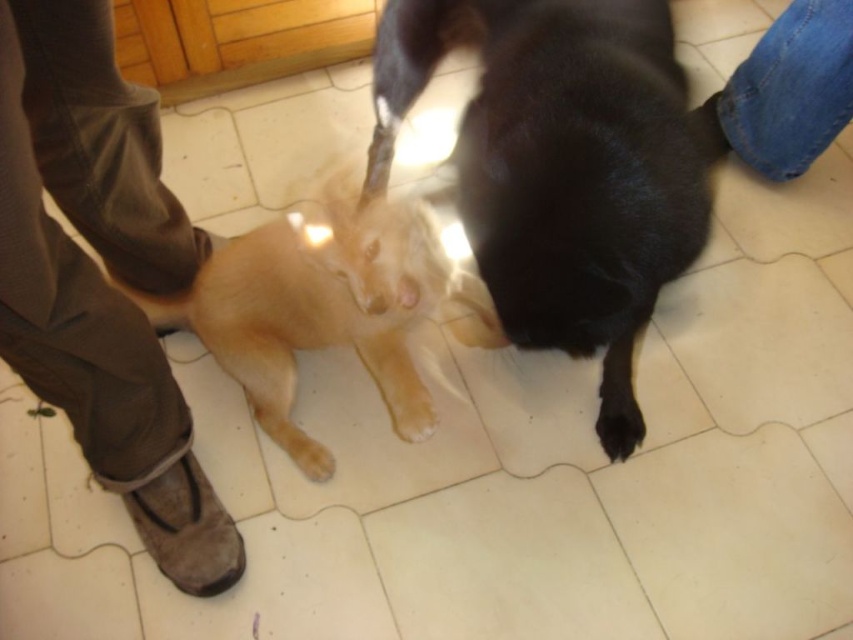
Is golden fur dog at center shorter than black fur paw at lower center?

Incorrect, golden fur dog at center's height does not fall short of black fur paw at lower center's.

Is golden fur dog at center smaller than black fur paw at lower center?

Incorrect, golden fur dog at center is not smaller in size than black fur paw at lower center.

At what (x,y) coordinates should I click in order to perform the action: click on golden fur dog at center. Please return your answer as a coordinate pair (x, y). Image resolution: width=853 pixels, height=640 pixels. Looking at the image, I should click on (328, 307).

Where is `golden fur dog at center`? The width and height of the screenshot is (853, 640). golden fur dog at center is located at coordinates (328, 307).

Measure the distance between jeans at right and black fur paw at lower center.

A distance of 28.34 inches exists between jeans at right and black fur paw at lower center.

From the picture: Does jeans at right have a smaller size compared to black fur paw at lower center?

Incorrect, jeans at right is not smaller in size than black fur paw at lower center.

Image resolution: width=853 pixels, height=640 pixels. What are the coordinates of `jeans at right` in the screenshot? It's located at (790, 90).

From the picture: Does golden fur dog at center have a lesser height compared to jeans at right?

In fact, golden fur dog at center may be taller than jeans at right.

Consider the image. Who is more forward, (398, 374) or (805, 51)?

Point (398, 374)

The image size is (853, 640). What do you see at coordinates (328, 307) in the screenshot? I see `golden fur dog at center` at bounding box center [328, 307].

At what (x,y) coordinates should I click in order to perform the action: click on golden fur dog at center. Please return your answer as a coordinate pair (x, y). Looking at the image, I should click on (328, 307).